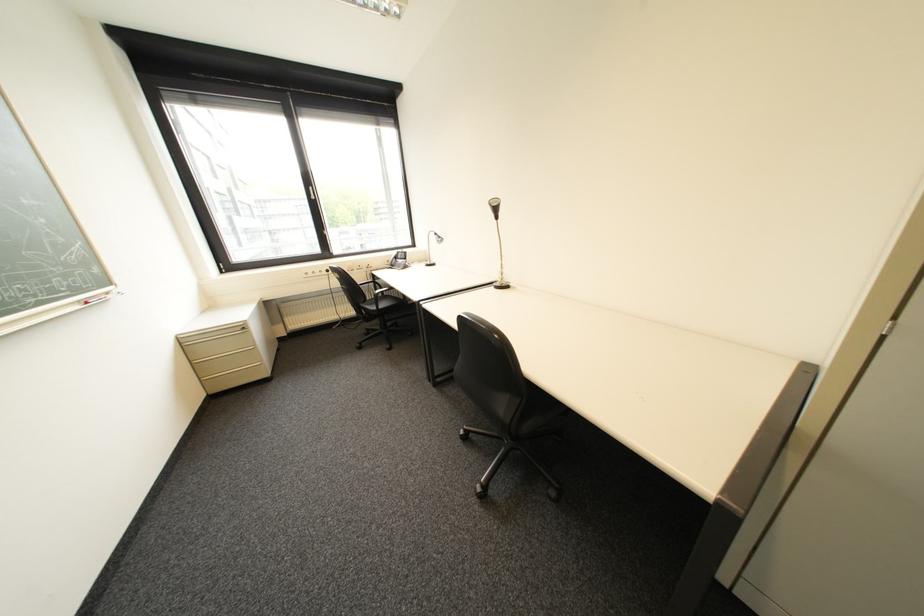
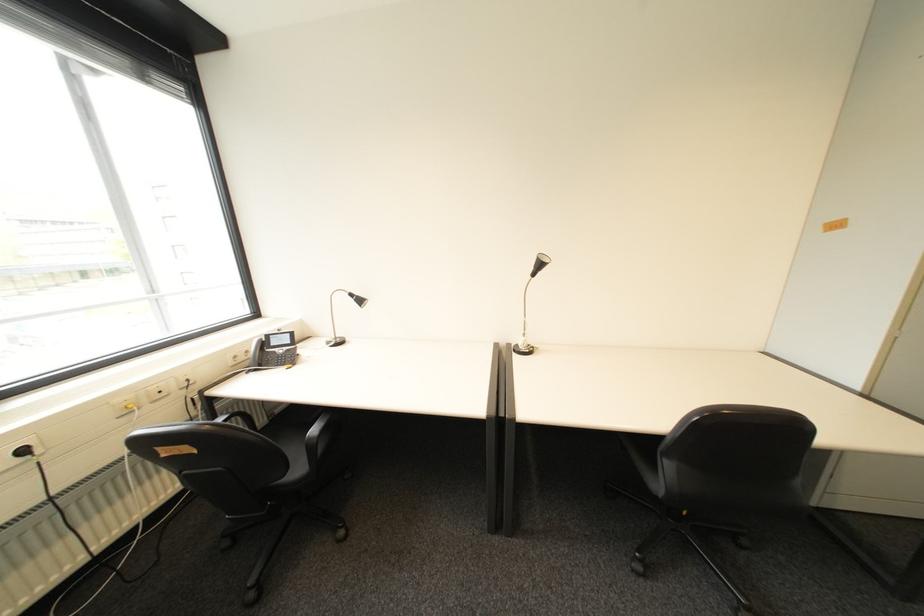
Where in the second image is the point corresponding to the point at 337,272 from the first image?

(34, 452)